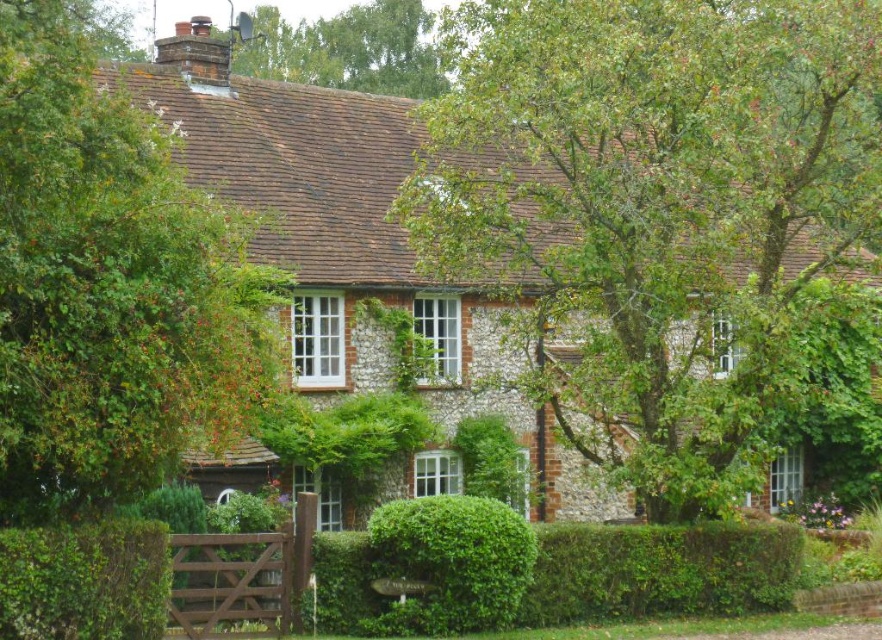
Consider the image. You are standing in front of the stone cottage and notice two green leafy plants. One is the green leafy tree at left and the other is the green leafy hedge at lower left. Which of these two plants is larger in size?

The green leafy tree at left is bigger than the green leafy hedge at lower left.

You are standing in front of the stone cottage and want to know the exact location of the green leafy hedge at center. Can you tell me its coordinates?

The green leafy hedge at center is located at coordinates point (451, 563).